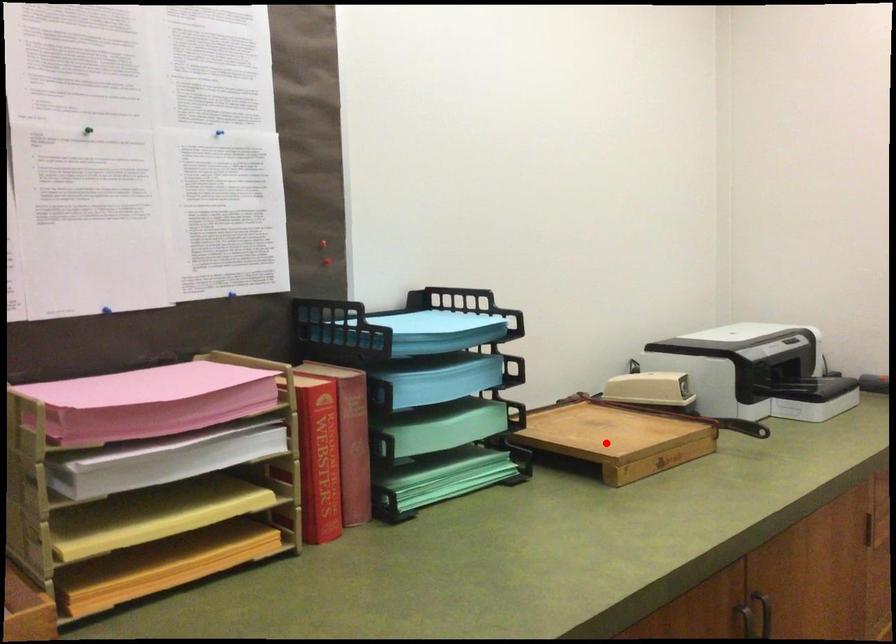
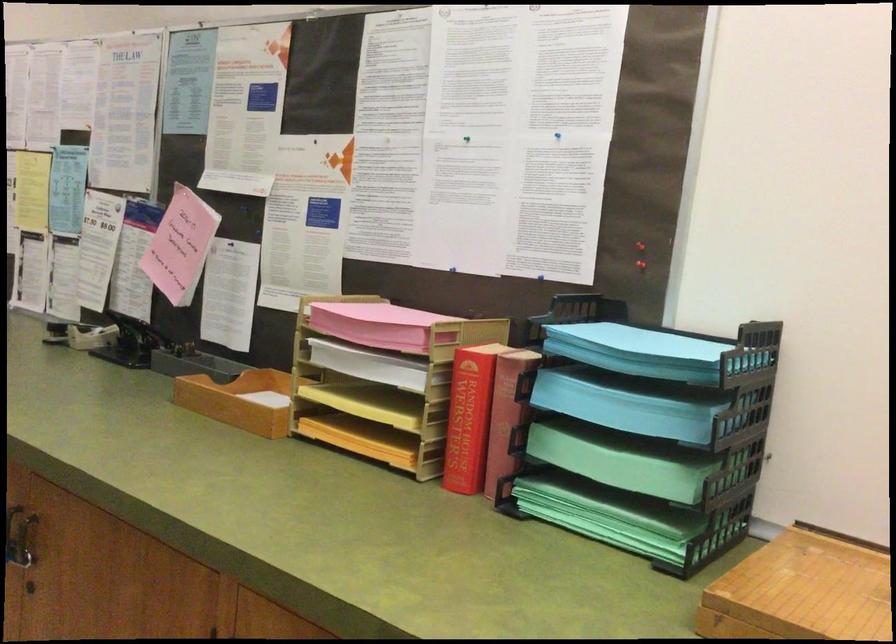
In the second image, find the point that corresponds to the highlighted location in the first image.

(800, 591)